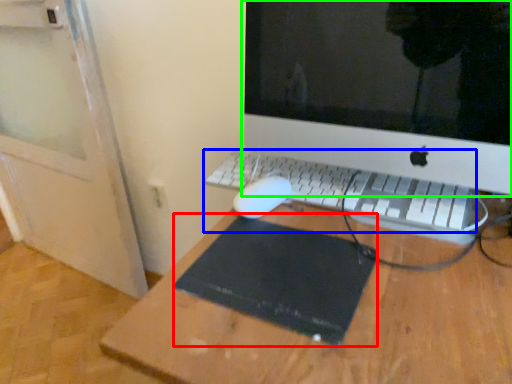
Question: Based on their relative distances, which object is farther from mousepad (highlighted by a red box)? Choose from computer keyboard (highlighted by a blue box) and computer monitor (highlighted by a green box).

Choices:
 (A) computer keyboard
 (B) computer monitor

Answer: (B)